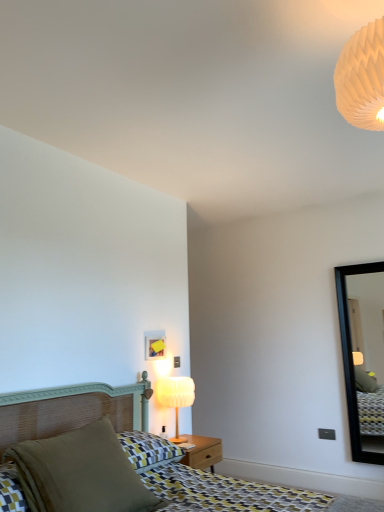
Question: Could you tell me if matte green pillow at lower left is turned towards matte white lamp at center?

Choices:
 (A) no
 (B) yes

Answer: (A)

Question: Can you confirm if matte green pillow at lower left is taller than matte white lamp at center?

Choices:
 (A) yes
 (B) no

Answer: (B)

Question: Is matte green pillow at lower left positioned in front of matte white lamp at center?

Choices:
 (A) no
 (B) yes

Answer: (B)

Question: Is matte green pillow at lower left bigger than matte white lamp at center?

Choices:
 (A) no
 (B) yes

Answer: (B)

Question: From the image's perspective, is matte green pillow at lower left over matte white lamp at center?

Choices:
 (A) no
 (B) yes

Answer: (B)

Question: Does matte green pillow at lower left have a lesser width compared to matte white lamp at center?

Choices:
 (A) no
 (B) yes

Answer: (A)

Question: Is black frame mirror at right turned away from white paper honeycomb at upper right?

Choices:
 (A) no
 (B) yes

Answer: (A)

Question: Is black frame mirror at right closer to the viewer compared to white paper honeycomb at upper right?

Choices:
 (A) yes
 (B) no

Answer: (B)

Question: Is black frame mirror at right further to the viewer compared to white paper honeycomb at upper right?

Choices:
 (A) yes
 (B) no

Answer: (A)

Question: Is white paper honeycomb at upper right a part of black frame mirror at right?

Choices:
 (A) yes
 (B) no

Answer: (B)

Question: Does black frame mirror at right have a larger size compared to white paper honeycomb at upper right?

Choices:
 (A) yes
 (B) no

Answer: (B)

Question: From a real-world perspective, is black frame mirror at right positioned over white paper honeycomb at upper right based on gravity?

Choices:
 (A) no
 (B) yes

Answer: (A)

Question: Would you say matte green pillow at lower left is part of matte white lamp at center's contents?

Choices:
 (A) yes
 (B) no

Answer: (B)